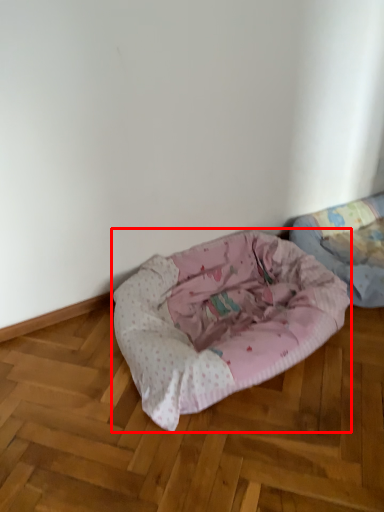
Question: From the image's perspective, considering the relative positions of dog bed (annotated by the red box) and dog bed in the image provided, where is dog bed (annotated by the red box) located with respect to the staircase?

Choices:
 (A) above
 (B) below

Answer: (B)